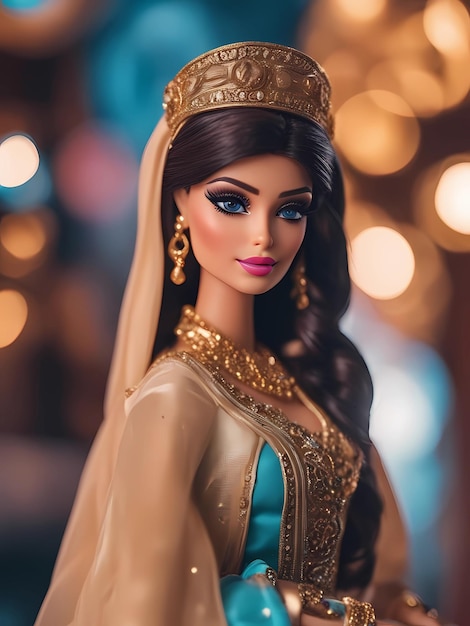
The width and height of the screenshot is (470, 626). In order to click on 1 coat in this screenshot , I will do `click(165, 499)`.